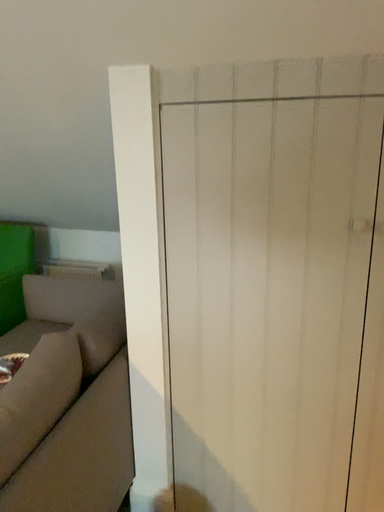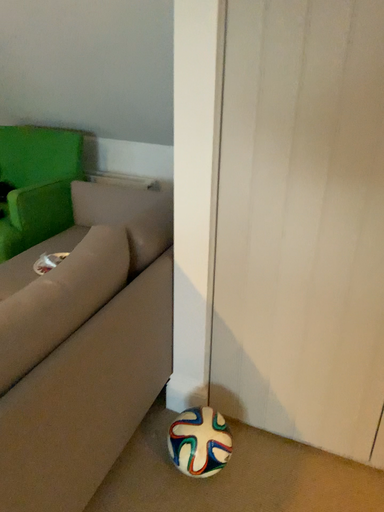
Question: Which way did the camera rotate in the video?

Choices:
 (A) rotated downward
 (B) rotated upward

Answer: (A)